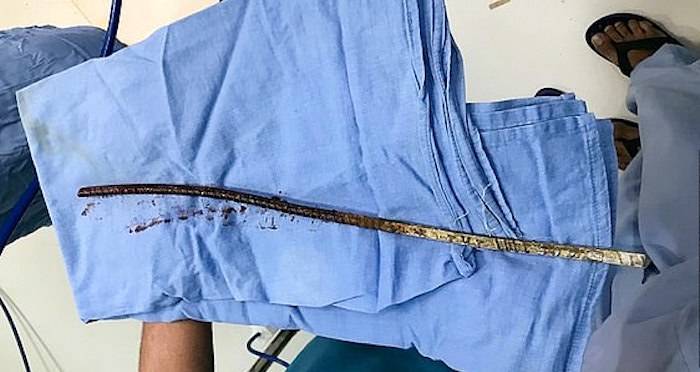
Locate an element on the screen. bar is located at coordinates (386, 225).